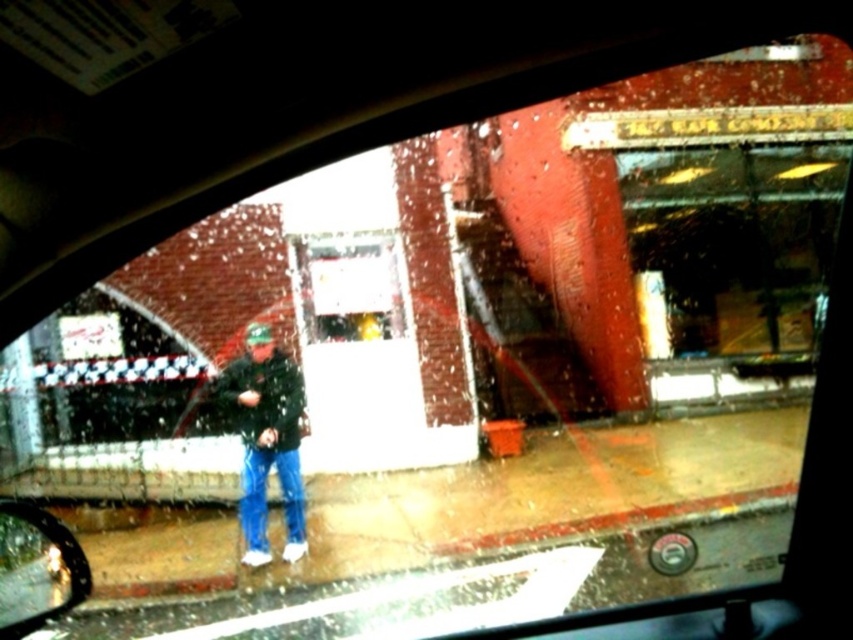
Question: Is dark green textured jacket at center wider than shiny black mirror at lower left?

Choices:
 (A) yes
 (B) no

Answer: (B)

Question: Can you confirm if dark green textured jacket at center is bigger than shiny black mirror at lower left?

Choices:
 (A) no
 (B) yes

Answer: (A)

Question: Among these objects, which one is nearest to the camera?

Choices:
 (A) shiny black mirror at lower left
 (B) dark green textured jacket at center

Answer: (A)

Question: Among these objects, which one is nearest to the camera?

Choices:
 (A) shiny black mirror at lower left
 (B) dark green textured jacket at center

Answer: (A)

Question: Which point is farther to the camera?

Choices:
 (A) dark green textured jacket at center
 (B) shiny black mirror at lower left

Answer: (A)

Question: Does dark green textured jacket at center lie in front of shiny black mirror at lower left?

Choices:
 (A) yes
 (B) no

Answer: (B)